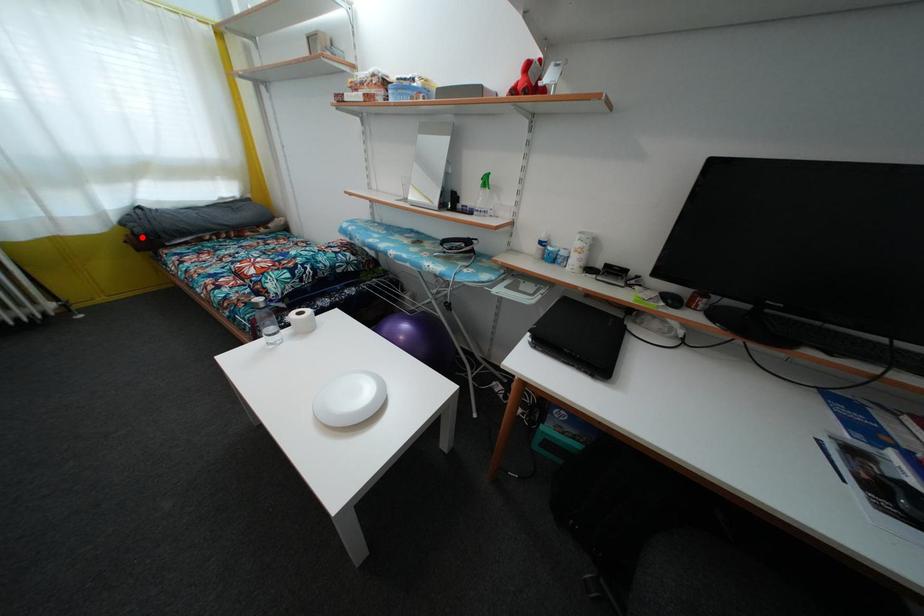
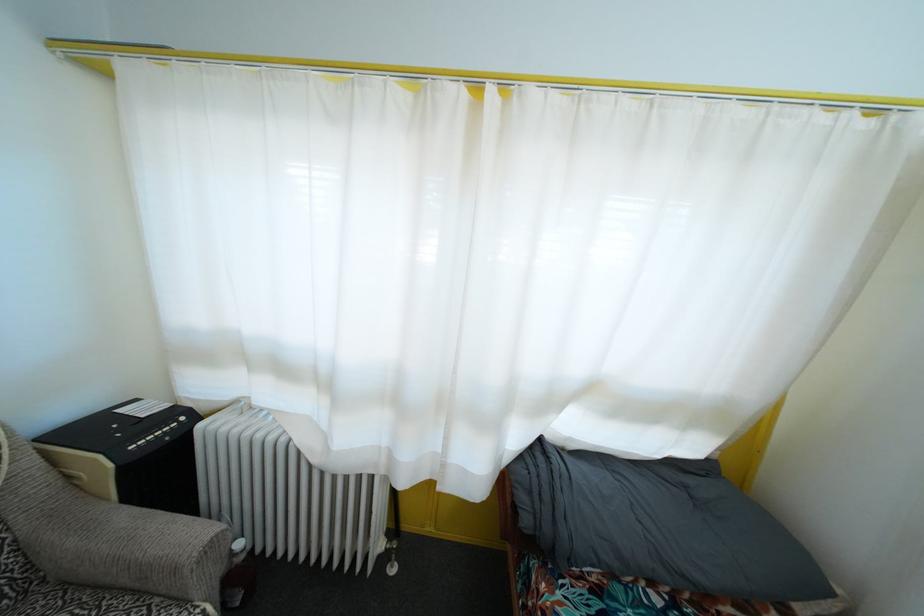
Locate, in the second image, the point that corresponds to the highlighted location in the first image.

(529, 528)